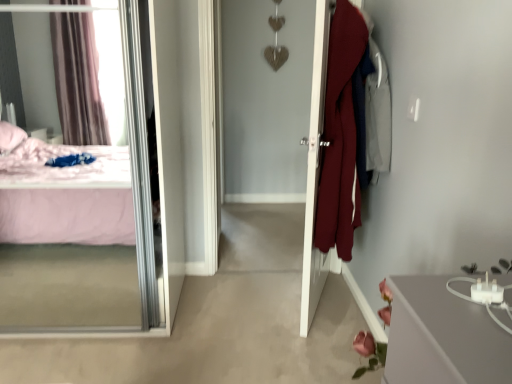
Question: Should I look upward or downward to see white glossy door at center?

Choices:
 (A) down
 (B) up

Answer: (B)

Question: Is white glossy door at center looking in the opposite direction of transparent glass mirror at left?

Choices:
 (A) yes
 (B) no

Answer: (B)

Question: Is white glossy door at center further to camera compared to transparent glass mirror at left?

Choices:
 (A) no
 (B) yes

Answer: (B)

Question: Can you confirm if white glossy door at center is shorter than transparent glass mirror at left?

Choices:
 (A) yes
 (B) no

Answer: (B)

Question: From a real-world perspective, is white glossy door at center on transparent glass mirror at left?

Choices:
 (A) no
 (B) yes

Answer: (B)

Question: Can you confirm if white glossy door at center is thinner than transparent glass mirror at left?

Choices:
 (A) no
 (B) yes

Answer: (B)

Question: Does white glossy door at center have a greater height compared to transparent glass mirror at left?

Choices:
 (A) yes
 (B) no

Answer: (A)

Question: Could you tell me if transparent glass mirror at left is turned towards white glossy door at center?

Choices:
 (A) yes
 (B) no

Answer: (B)

Question: From a real-world perspective, is transparent glass mirror at left on top of white glossy door at center?

Choices:
 (A) yes
 (B) no

Answer: (B)

Question: Is transparent glass mirror at left outside white glossy door at center?

Choices:
 (A) no
 (B) yes

Answer: (B)

Question: From the image's perspective, is transparent glass mirror at left beneath white glossy door at center?

Choices:
 (A) no
 (B) yes

Answer: (B)

Question: Does transparent glass mirror at left have a smaller size compared to white glossy door at center?

Choices:
 (A) no
 (B) yes

Answer: (A)

Question: From the image's perspective, is transparent glass mirror at left above white glossy door at center?

Choices:
 (A) no
 (B) yes

Answer: (A)

Question: Is transparent glass mirror at left to the left or to the right of white glossy door at center in the image?

Choices:
 (A) left
 (B) right

Answer: (A)